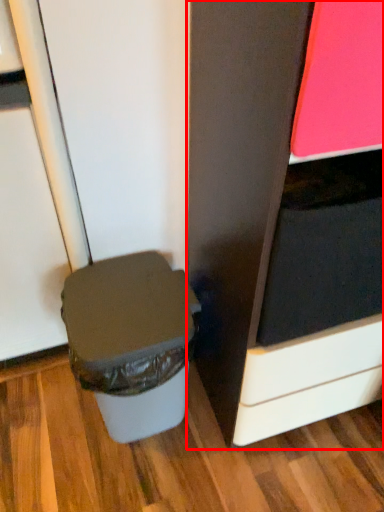
Question: From the image's perspective, where is cabinetry (annotated by the red box) located in relation to waste container in the image?

Choices:
 (A) below
 (B) above

Answer: (B)